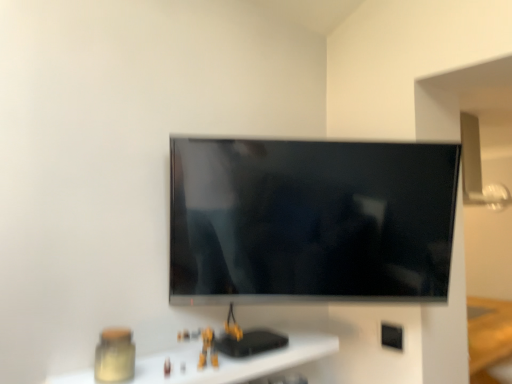
Question: Are matte glass jar at lower left and flat screen tv at center far apart?

Choices:
 (A) no
 (B) yes

Answer: (A)

Question: Is matte glass jar at lower left shorter than flat screen tv at center?

Choices:
 (A) yes
 (B) no

Answer: (A)

Question: Is matte glass jar at lower left located outside flat screen tv at center?

Choices:
 (A) no
 (B) yes

Answer: (B)

Question: Is matte glass jar at lower left positioned before flat screen tv at center?

Choices:
 (A) no
 (B) yes

Answer: (B)

Question: From a real-world perspective, does matte glass jar at lower left sit lower than flat screen tv at center?

Choices:
 (A) no
 (B) yes

Answer: (B)

Question: Is flat screen tv at center completely or partially inside matte glass jar at lower left?

Choices:
 (A) no
 (B) yes

Answer: (A)

Question: Is flat screen tv at center smaller than black plastic electric outlet at lower right?

Choices:
 (A) no
 (B) yes

Answer: (A)

Question: From a real-world perspective, is flat screen tv at center below black plastic electric outlet at lower right?

Choices:
 (A) yes
 (B) no

Answer: (B)

Question: Is flat screen tv at center at the left side of black plastic electric outlet at lower right?

Choices:
 (A) no
 (B) yes

Answer: (B)

Question: Is flat screen tv at center facing away from black plastic electric outlet at lower right?

Choices:
 (A) no
 (B) yes

Answer: (A)

Question: Is the depth of flat screen tv at center greater than that of black plastic electric outlet at lower right?

Choices:
 (A) yes
 (B) no

Answer: (B)

Question: Could you tell me if flat screen tv at center is facing black plastic electric outlet at lower right?

Choices:
 (A) no
 (B) yes

Answer: (A)

Question: Is black plastic electric outlet at lower right bigger than matte glass jar at lower left?

Choices:
 (A) no
 (B) yes

Answer: (A)